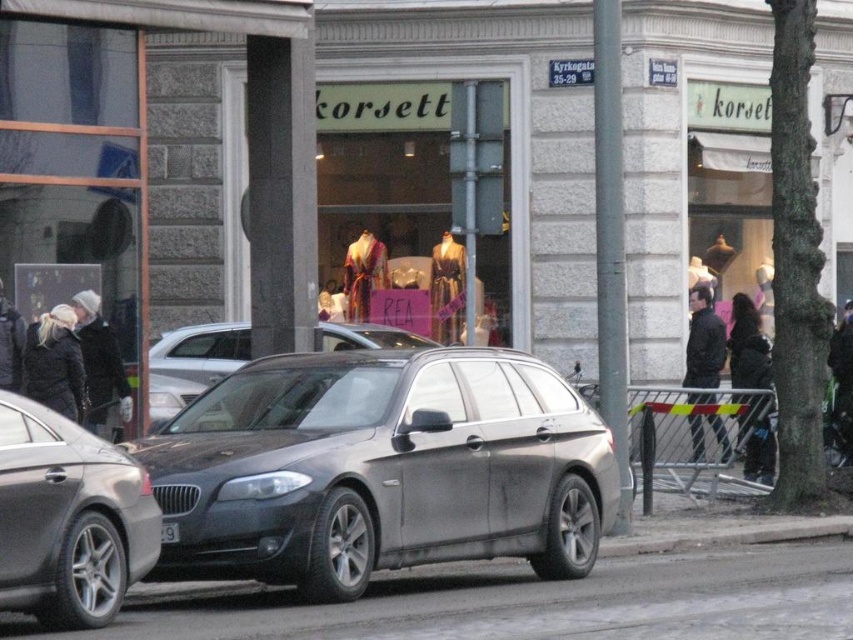
Who is shorter, matte glass shop window at center or black plastic license plate at center?

black plastic license plate at center is shorter.

Identify the location of matte glass shop window at center. (418, 214).

The image size is (853, 640). I want to click on matte glass shop window at center, so [418, 214].

Is dark gray metallic car at center bigger than satin silver car at center?

Actually, dark gray metallic car at center might be smaller than satin silver car at center.

Is point (103, 499) farther from viewer compared to point (160, 413)?

No, it is not.

Locate an element on the screen. The image size is (853, 640). dark gray metallic car at center is located at coordinates (68, 518).

Who is shorter, clear glass window at upper left or dark gray metallic car at center?

dark gray metallic car at center

Between clear glass window at upper left and dark gray metallic car at center, which one appears on the left side from the viewer's perspective?

From the viewer's perspective, clear glass window at upper left appears more on the left side.

Which is behind, point (85, 29) or point (103, 496)?

Point (85, 29)

You are a GUI agent. You are given a task and a screenshot of the screen. Output one action in this format:
    pyautogui.click(x=<x>, y=<y>)
    Task: Click on the clear glass window at upper left
    
    Given the screenshot: What is the action you would take?
    pyautogui.click(x=77, y=163)